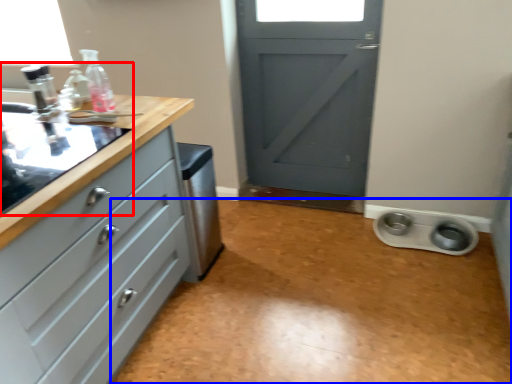
Question: Which of the following is the farthest to the observer, sink (highlighted by a red box) or plain (highlighted by a blue box)?

Choices:
 (A) sink
 (B) plain

Answer: (B)